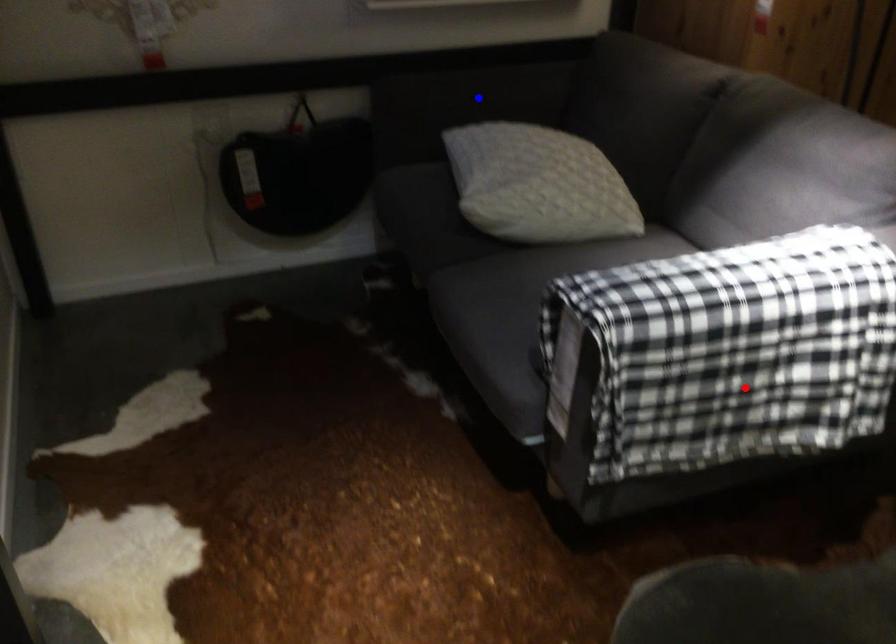
Question: Two points are marked on the image. Which point is closer to the camera?

Choices:
 (A) Blue point is closer.
 (B) Red point is closer.

Answer: (B)